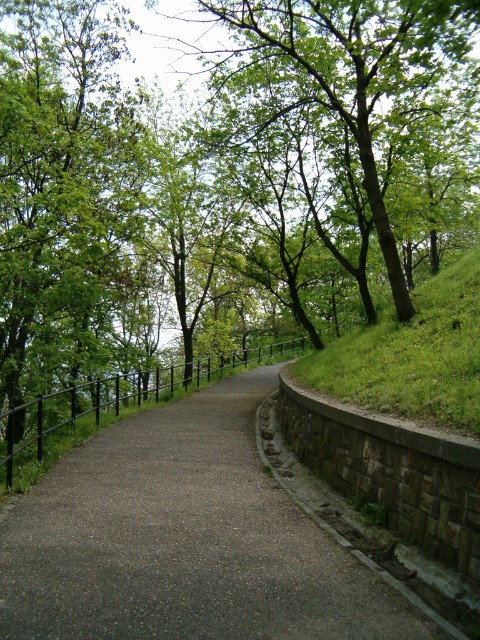
Does green leafy tree at upper center have a lesser height compared to black metal fence at center?

No.

Measure the distance between point (207, 132) and camera.

20.56 meters

In the scene shown: Who is more distant from viewer, (331, 234) or (61, 438)?

The point (331, 234) is more distant.

Identify the location of green leafy tree at upper center. The image size is (480, 640). (348, 113).

In the scene shown: Is dark gray asphalt road at center closer to camera compared to green leafy tree at upper center?

Yes, dark gray asphalt road at center is in front of green leafy tree at upper center.

Can you confirm if dark gray asphalt road at center is positioned to the right of green leafy tree at upper center?

Incorrect, dark gray asphalt road at center is not on the right side of green leafy tree at upper center.

Which is behind, point (171, 525) or point (382, 202)?

Positioned behind is point (382, 202).

This screenshot has width=480, height=640. What are the coordinates of `dark gray asphalt road at center` in the screenshot? It's located at (184, 540).

How distant is green leafy tree at upper left from black metal fence at center?

green leafy tree at upper left and black metal fence at center are 18.10 feet apart from each other.

Does green leafy tree at upper left appear on the left side of black metal fence at center?

Yes, green leafy tree at upper left is to the left of black metal fence at center.

Who is more forward, (69, 269) or (194, 362)?

Point (69, 269) is in front.

Find the location of a particular element. This screenshot has width=480, height=640. green leafy tree at upper left is located at coordinates (68, 198).